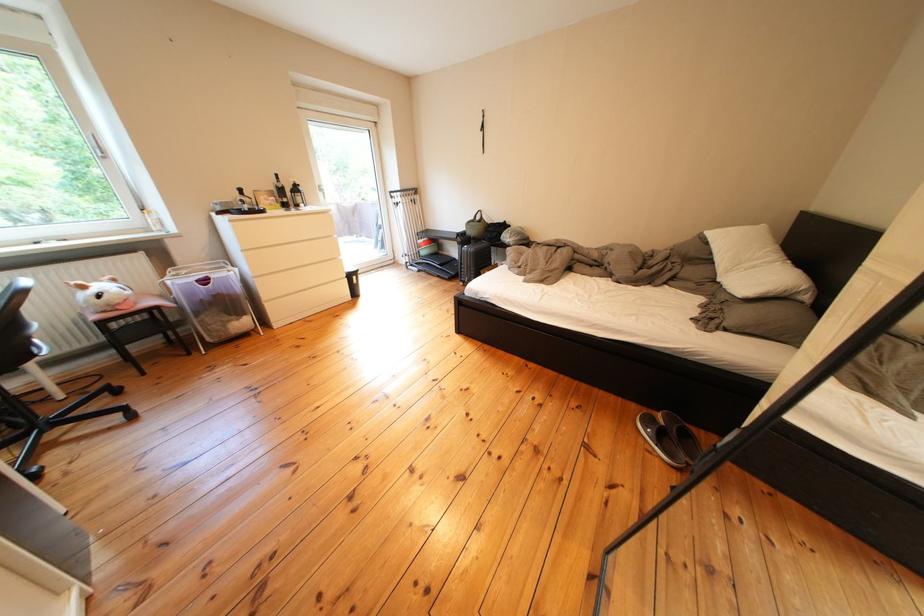
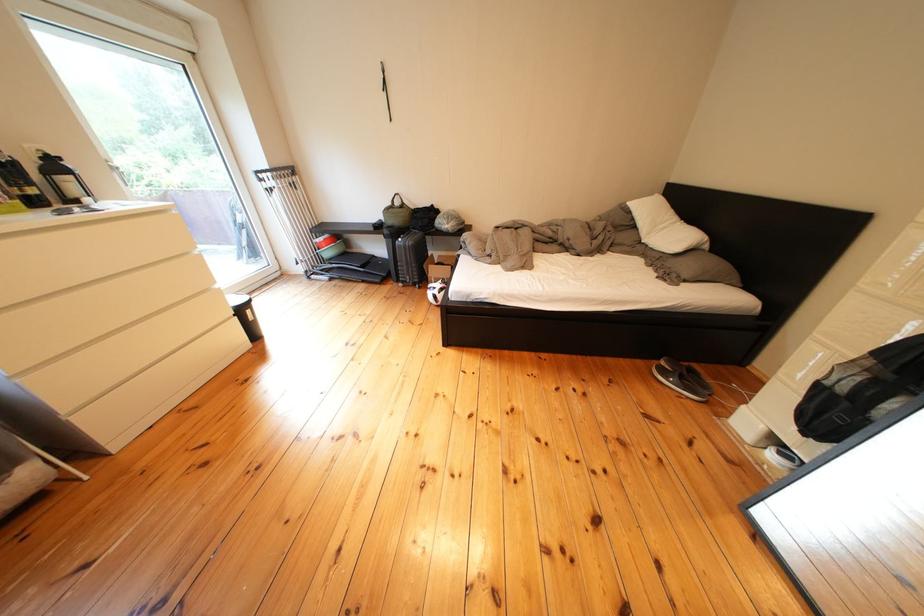
In the second image, find the point that corresponds to (x=348, y=264) in the first image.

(220, 294)